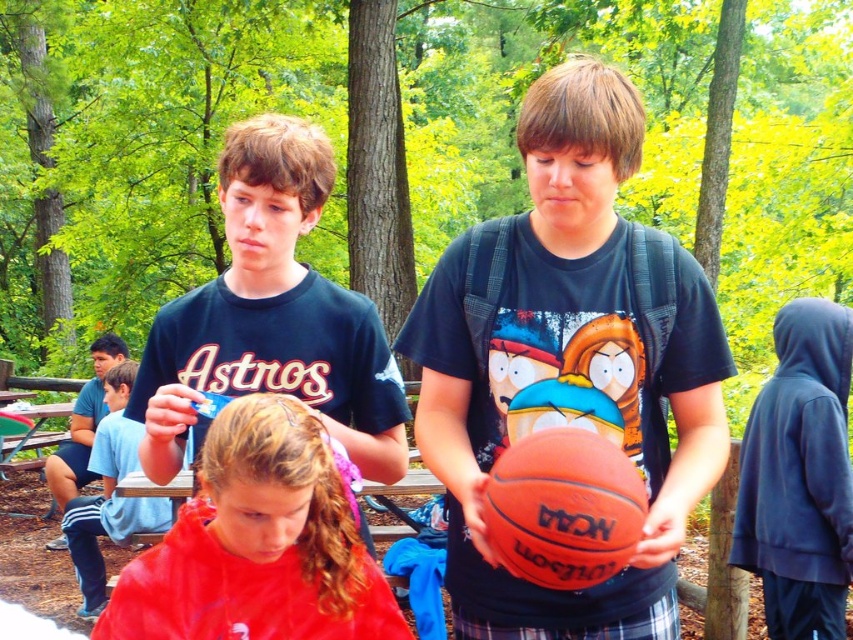
Identify the location of rubber basketball at center. (566, 364).

From the picture: Can you confirm if rubber basketball at center is positioned above orange matte basketball at center?

Yes.

Find the location of `rubber basketball at center`. rubber basketball at center is located at coordinates (566, 364).

Which is in front, point (498, 497) or point (142, 531)?

Point (498, 497) is in front.

Who is more distant from viewer, (523, 522) or (115, 401)?

Positioned behind is point (115, 401).

Between point (590, 538) and point (96, 525), which one is positioned behind?

Point (96, 525)

The width and height of the screenshot is (853, 640). Find the location of `orange matte basketball at center`. orange matte basketball at center is located at coordinates (563, 508).

Between point (242, 124) and point (97, 364), which one is positioned in front?

Point (242, 124) is in front.

Does matte black shirt at center lie behind light blue cotton shirt at left?

No, matte black shirt at center is closer to the viewer.

Find the location of a particular element. The image size is (853, 640). matte black shirt at center is located at coordinates (271, 316).

This screenshot has height=640, width=853. Identify the location of matte black shirt at center. (271, 316).